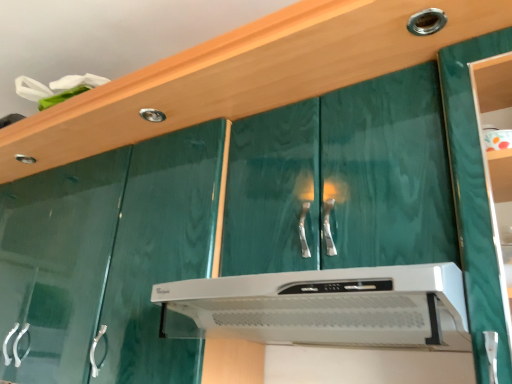
What is the approximate width of metallic silver knob at upper right?

3.35 inches.

The image size is (512, 384). Describe the element at coordinates (426, 22) in the screenshot. I see `metallic silver knob at upper right` at that location.

Locate an element on the screen. metallic silver knob at upper right is located at coordinates (426, 22).

Measure the distance between point [440,15] and camera.

The distance of point [440,15] from camera is 34.21 inches.

What is the approximate height of metallic silver knob at upper right?

metallic silver knob at upper right is 0.61 inches tall.

Image resolution: width=512 pixels, height=384 pixels. What do you see at coordinates (324, 307) in the screenshot?
I see `white plastic range hood at center` at bounding box center [324, 307].

This screenshot has width=512, height=384. What are the coordinates of `white plastic range hood at center` in the screenshot? It's located at (324, 307).

Image resolution: width=512 pixels, height=384 pixels. What are the coordinates of `metallic silver knob at upper right` in the screenshot? It's located at (426, 22).

Does white plastic range hood at center appear on the left side of metallic silver knob at upper right?

Correct, you'll find white plastic range hood at center to the left of metallic silver knob at upper right.

Which object is further away from the camera taking this photo, white plastic range hood at center or metallic silver knob at upper right?

metallic silver knob at upper right is more distant.

Between point (298, 272) and point (426, 15), which one is positioned in front?

Point (298, 272)

From the image's perspective, is white plastic range hood at center positioned above or below metallic silver knob at upper right?

white plastic range hood at center is below metallic silver knob at upper right.

From a real-world perspective, which is physically below, white plastic range hood at center or metallic silver knob at upper right?

white plastic range hood at center.

Between white plastic range hood at center and metallic silver knob at upper right, which one has larger width?

Wider between the two is white plastic range hood at center.

From their relative heights in the image, would you say white plastic range hood at center is taller or shorter than metallic silver knob at upper right?

Considering their sizes, white plastic range hood at center has more height than metallic silver knob at upper right.

Between white plastic range hood at center and metallic silver knob at upper right, which one has smaller size?

With smaller size is metallic silver knob at upper right.

Is white plastic range hood at center not within metallic silver knob at upper right?

Yes, white plastic range hood at center is located beyond the bounds of metallic silver knob at upper right.

Does white plastic range hood at center touch metallic silver knob at upper right?

They are not placed beside each other.

Does white plastic range hood at center turn towards metallic silver knob at upper right?

No, white plastic range hood at center does not turn towards metallic silver knob at upper right.

What's the angular difference between white plastic range hood at center and metallic silver knob at upper right's facing directions?

white plastic range hood at center and metallic silver knob at upper right are facing 0.587 degrees away from each other.

How far apart are white plastic range hood at center and metallic silver knob at upper right?

A distance of 25.94 inches exists between white plastic range hood at center and metallic silver knob at upper right.

Where is `knob that appears behind the white plastic range hood at center`? The height and width of the screenshot is (384, 512). knob that appears behind the white plastic range hood at center is located at coordinates (426, 22).

Is metallic silver knob at upper right to the right of white plastic range hood at center from the viewer's perspective?

Yes, metallic silver knob at upper right is to the right of white plastic range hood at center.

Is metallic silver knob at upper right further to the viewer compared to white plastic range hood at center?

Yes, metallic silver knob at upper right is further from the camera.

Which point is more forward, (444, 24) or (289, 335)?

The point (289, 335) is closer.

From the image's perspective, which one is positioned lower, metallic silver knob at upper right or white plastic range hood at center?

white plastic range hood at center, from the image's perspective.

From a real-world perspective, is metallic silver knob at upper right located higher than white plastic range hood at center?

Yes.

Is metallic silver knob at upper right wider than white plastic range hood at center?

Answer: No.

Considering the relative sizes of metallic silver knob at upper right and white plastic range hood at center in the image provided, is metallic silver knob at upper right shorter than white plastic range hood at center?

Indeed, metallic silver knob at upper right has a lesser height compared to white plastic range hood at center.

Who is bigger, metallic silver knob at upper right or white plastic range hood at center?

white plastic range hood at center is bigger.

Is metallic silver knob at upper right inside or outside of white plastic range hood at center?

metallic silver knob at upper right exists outside the volume of white plastic range hood at center.

Consider the image. Are metallic silver knob at upper right and white plastic range hood at center far apart?

No, metallic silver knob at upper right is not far away from white plastic range hood at center.

Could you tell me if metallic silver knob at upper right is turned towards white plastic range hood at center?

No, metallic silver knob at upper right does not turn towards white plastic range hood at center.

How different are the orientations of metallic silver knob at upper right and white plastic range hood at center in degrees?

The facing directions of metallic silver knob at upper right and white plastic range hood at center are 0.587 degrees apart.

How distant is metallic silver knob at upper right from white plastic range hood at center?

The distance of metallic silver knob at upper right from white plastic range hood at center is 25.94 inches.

Where is `knob behind the white plastic range hood at center`? The width and height of the screenshot is (512, 384). knob behind the white plastic range hood at center is located at coordinates (426, 22).

Find the location of a particular element. The height and width of the screenshot is (384, 512). home appliance that appears below the metallic silver knob at upper right (from the image's perspective) is located at coordinates (324, 307).

Locate an element on the screen. This screenshot has width=512, height=384. knob lying behind the white plastic range hood at center is located at coordinates (426, 22).